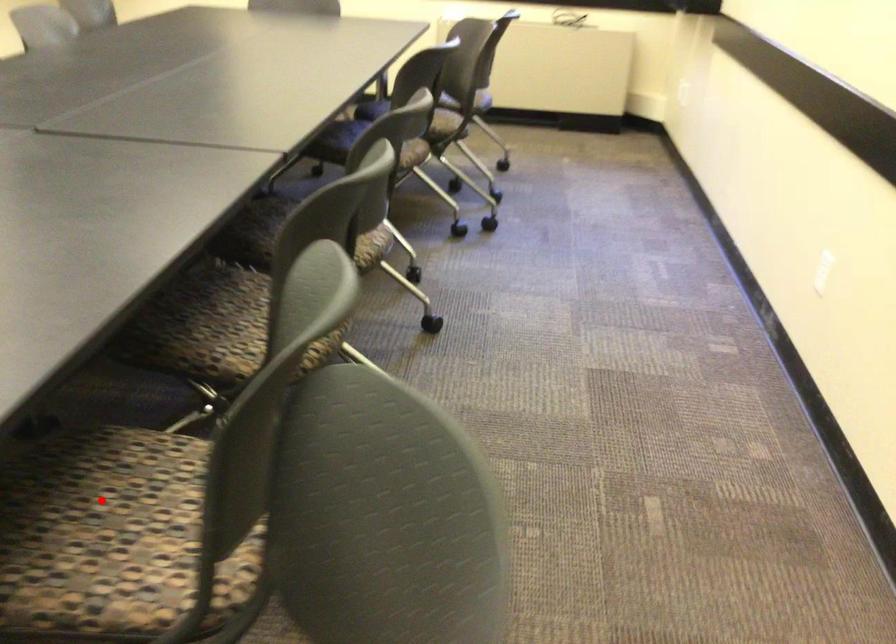
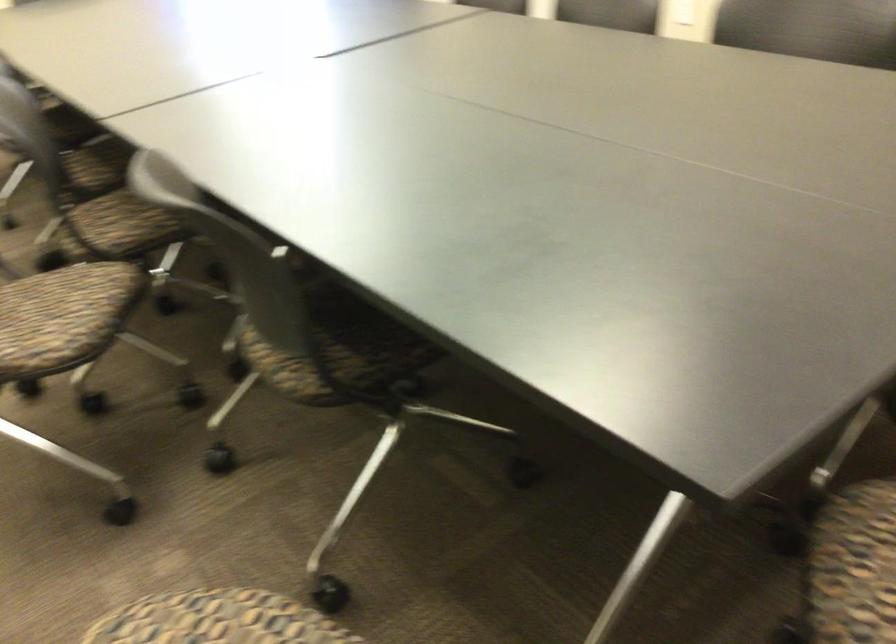
Question: I am providing you with two images of the same scene from different viewpoints. A red point is marked on the first image. At the location where the point appears in image 1, is it still visible in image 2?

Choices:
 (A) Yes
 (B) No

Answer: (B)